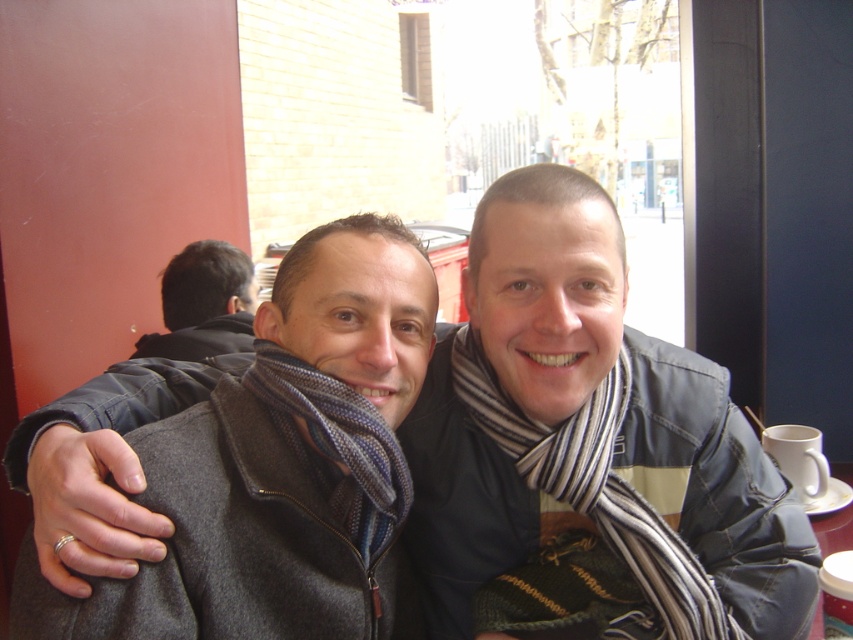
You are a photographer trying to capture a closeup of both the dark gray wool scarf at center and the striped fabric scarf at center without any overlap. Given their widths, which scarf should you adjust to avoid overlapping?

The dark gray wool scarf at center is wider than the striped fabric scarf at center. To avoid overlapping, adjust the wider dark gray wool scarf at center first.

What is the color of the scarf located at the coordinates point (x=280, y=465)?

The point (x=280, y=465) indicates dark gray wool scarf at center, so the color is dark gray.

You are a photographer adjusting the camera focus. You need to ensure both the striped scarf at center and the dark gray wool scarf at center are in focus. Given their sizes, which scarf should you focus on first to ensure the smaller one is also in focus?

The striped scarf at center is bigger than dark gray wool scarf at center. To ensure both are in focus, you should focus on the dark gray wool scarf at center first since it is smaller and closer to the camera.